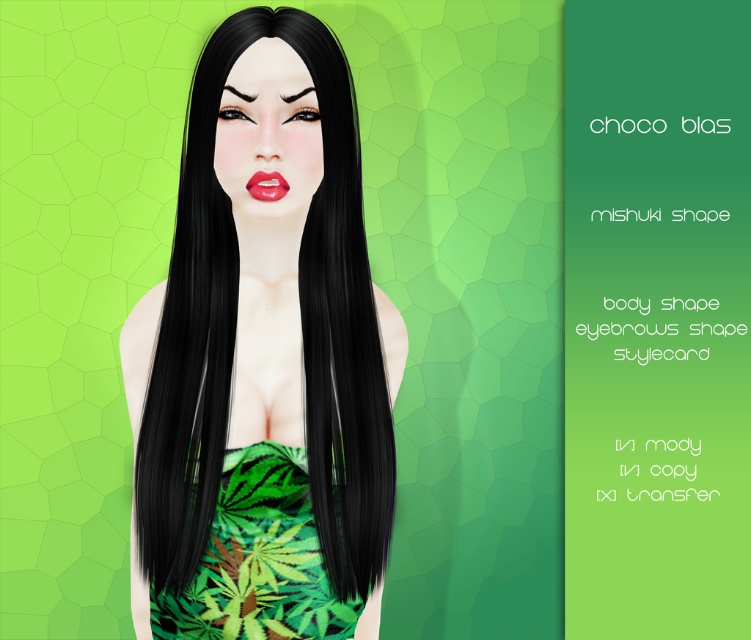
Question: Does shiny black hair at center come behind green leafy fabric dress at center?

Choices:
 (A) no
 (B) yes

Answer: (A)

Question: Which point is closer to the camera?

Choices:
 (A) green leafy fabric dress at center
 (B) shiny black hair at center
 (C) matte red lips at center

Answer: (B)

Question: Among these objects, which one is nearest to the camera?

Choices:
 (A) green leafy fabric dress at center
 (B) matte red lips at center

Answer: (B)

Question: Does shiny black hair at center lie in front of matte red lips at center?

Choices:
 (A) yes
 (B) no

Answer: (A)

Question: Based on their relative distances, which object is nearer to the matte red lips at center?

Choices:
 (A) shiny black hair at center
 (B) green leafy fabric dress at center

Answer: (A)

Question: Considering the relative positions of green leafy fabric dress at center and matte red lips at center in the image provided, where is green leafy fabric dress at center located with respect to matte red lips at center?

Choices:
 (A) left
 (B) right

Answer: (A)